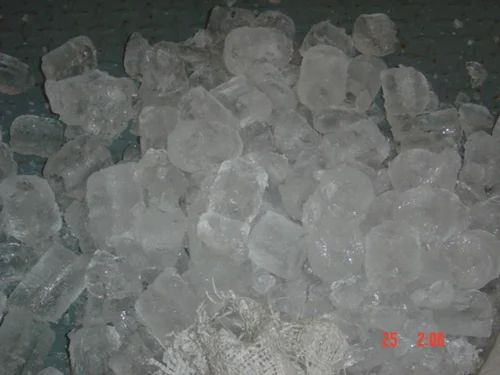
Identify the location of table surface visible between ice cubes. (121, 145), (62, 335), (33, 162), (31, 106).